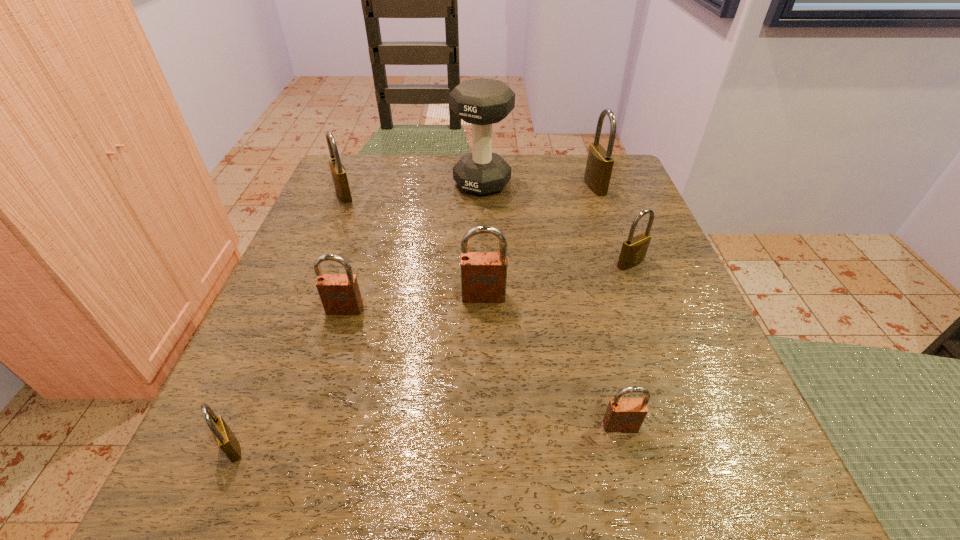
At what (x,y) coordinates should I click in order to perform the action: click on free region located 0.080m on the front-facing side of the third padlock from right to left. Please return your answer as a coordinate pair (x, y). The width and height of the screenshot is (960, 540). Looking at the image, I should click on (638, 496).

In order to click on vacant space situated on the back of the smallest brass padlock in this screenshot , I will do `click(268, 363)`.

Locate an element on the screen. The image size is (960, 540). dumbbell located in the far edge section of the desktop is located at coordinates (481, 102).

Where is `object at the near edge`? object at the near edge is located at coordinates (224, 437).

Identify the location of object that is positioned at the far left corner. This screenshot has height=540, width=960. (338, 171).

The image size is (960, 540). Identify the location of object at the near left corner. (224, 437).

In order to click on object that is at the far right corner in this screenshot , I will do `click(599, 165)`.

Where is `free space at the far edge of the desktop`? The image size is (960, 540). free space at the far edge of the desktop is located at coordinates (556, 164).

The width and height of the screenshot is (960, 540). Identify the location of vacant area at the near edge. (430, 517).

This screenshot has width=960, height=540. I want to click on blank area at the left edge, so 313,299.